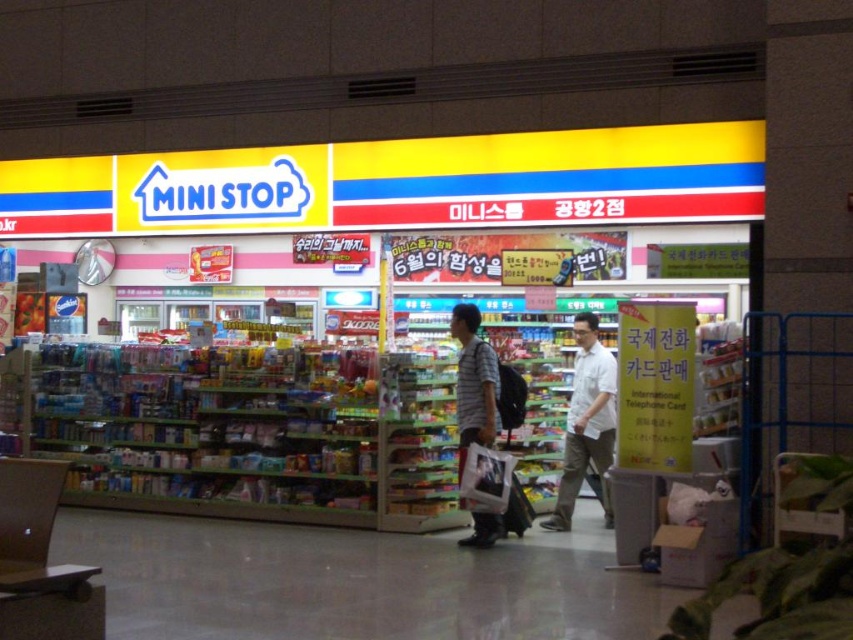
You are a customer entering the Mini Stop convenience store and notice the yellow matte sign at upper center and the white cotton shirt at center. Which object is wider?

The yellow matte sign at upper center is wider than the white cotton shirt at center.

You are a customer in the Mini Stop store and you want to read the text on the yellow matte sign at upper center. However, there is a striped cotton shirt at center blocking your view. Can you see the sign clearly?

The yellow matte sign at upper center is in front of the striped cotton shirt at center, so you can see the sign clearly without any obstruction.